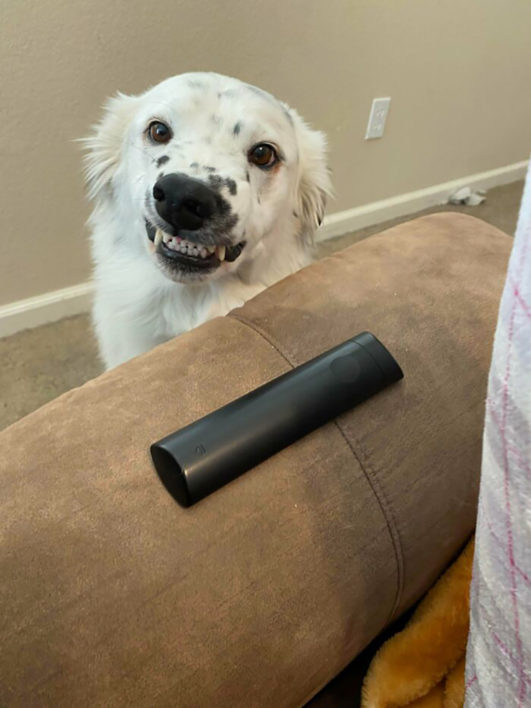
The height and width of the screenshot is (708, 531). I want to click on couch arm, so click(x=162, y=600).